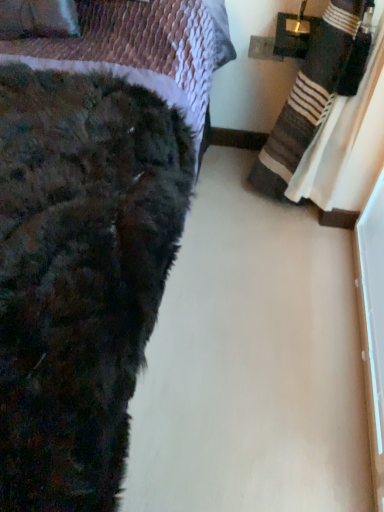
Where is `vacant space positioned to the left of striped cotton blanket at right`? vacant space positioned to the left of striped cotton blanket at right is located at coordinates (215, 217).